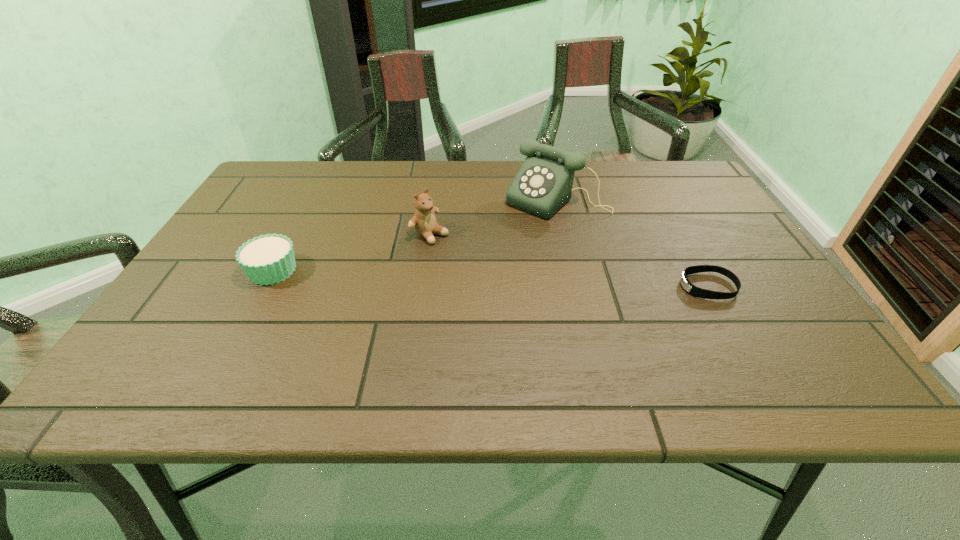
At what (x,y) coordinates should I click in order to perform the action: click on free space on the desktop that is between the cupcake and the shortest object and is positioned on the front-facing side of the second tallest object. Please return your answer as a coordinate pair (x, y). Image resolution: width=960 pixels, height=540 pixels. Looking at the image, I should click on click(x=509, y=279).

You are a GUI agent. You are given a task and a screenshot of the screen. Output one action in this format:
    pyautogui.click(x=<x>, y=<y>)
    Task: Click on the vacant space on the desktop that is between the cupcake and the shortest object and is positioned on the dial of the tallest object
    Image resolution: width=960 pixels, height=540 pixels.
    Given the screenshot: What is the action you would take?
    pyautogui.click(x=472, y=278)